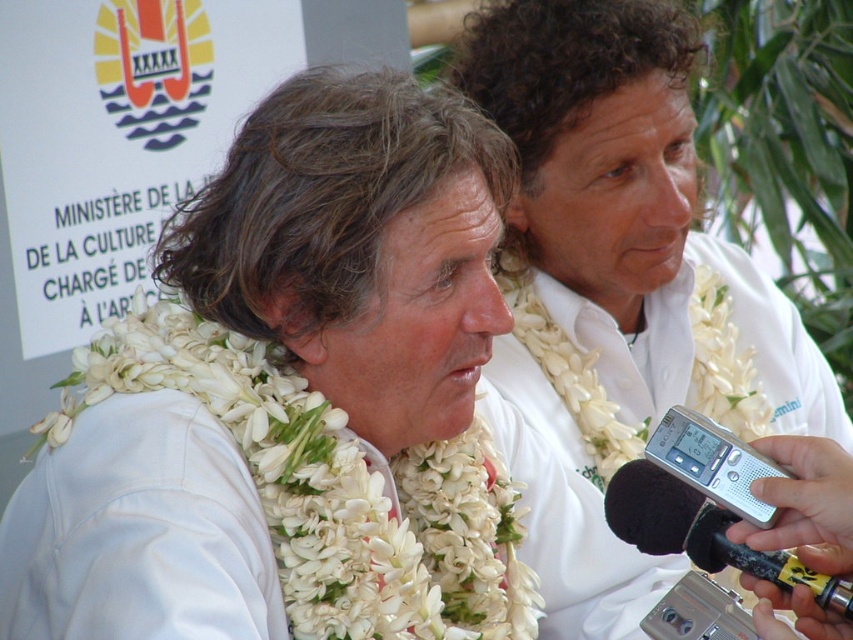
You are a photographer adjusting your camera to focus on two points in the scene. The first point is at coordinate point (471, 515) and the second is at point (732, 628). Which point should you focus on first if you want to capture the closest object to the camera in the image?

Point (471, 515) is further to the camera than point (732, 628), so you should focus on point (471, 515) first as it is closer to the camera.

You are a photographer at the event and need to capture a closeup shot of the white fabric lei at center and the silver metallic video camera at lower center. Which object is wider?

The white fabric lei at center is wider than the silver metallic video camera at lower center according to the description.